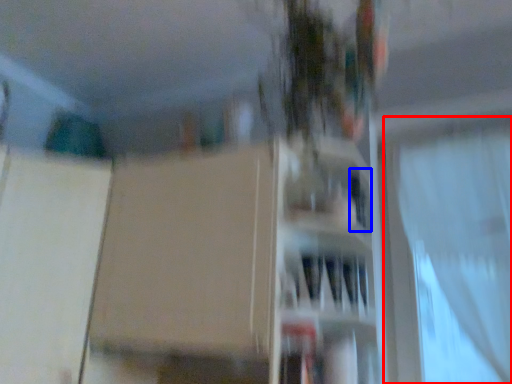
Question: Which of the following is the farthest to the observer, curtain (highlighted by a red box) or window (highlighted by a blue box)?

Choices:
 (A) curtain
 (B) window

Answer: (B)